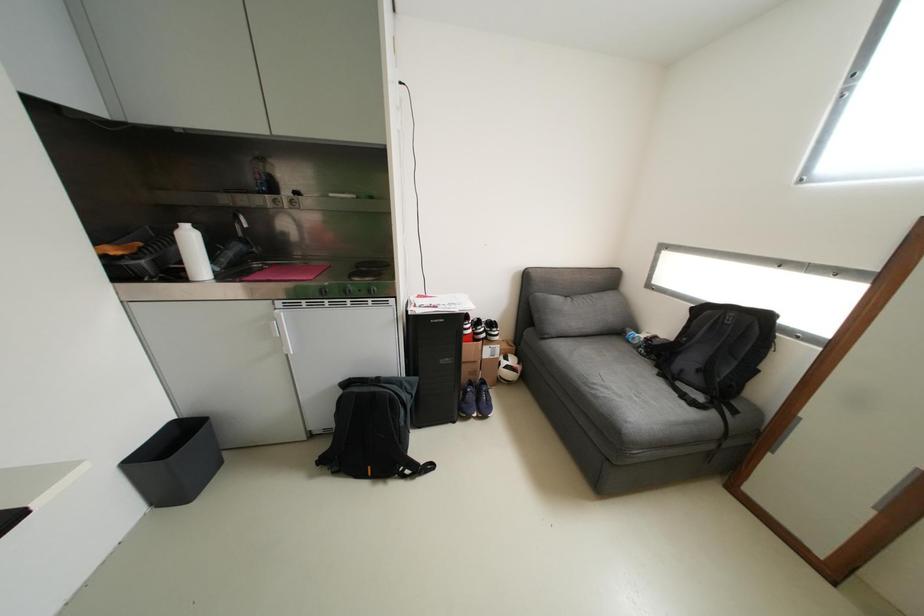
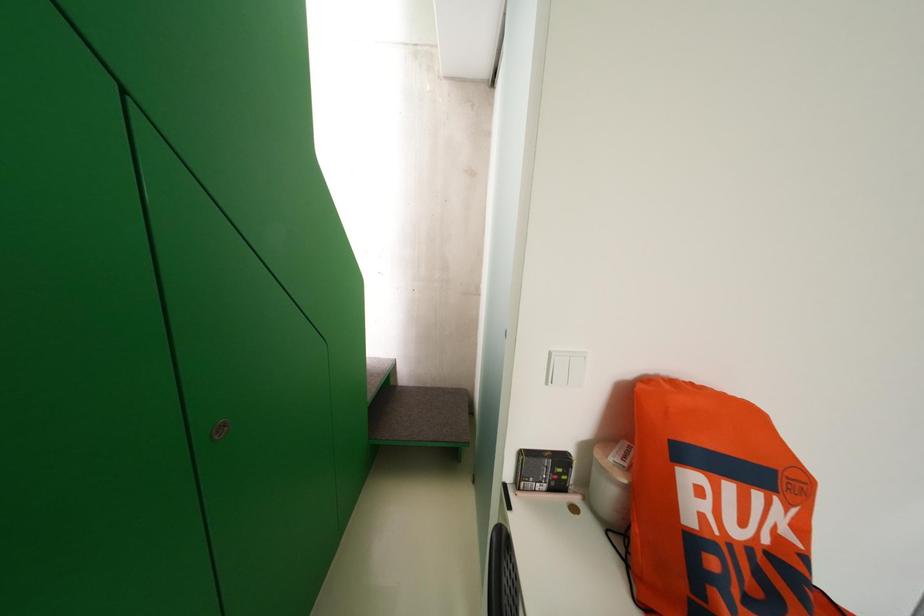
Question: Based on the continuous images, in which direction is the camera rotating? Reply with the corresponding letter.

Choices:
 (A) Left
 (B) Right
 (C) Up
 (D) Down

Answer: (A)